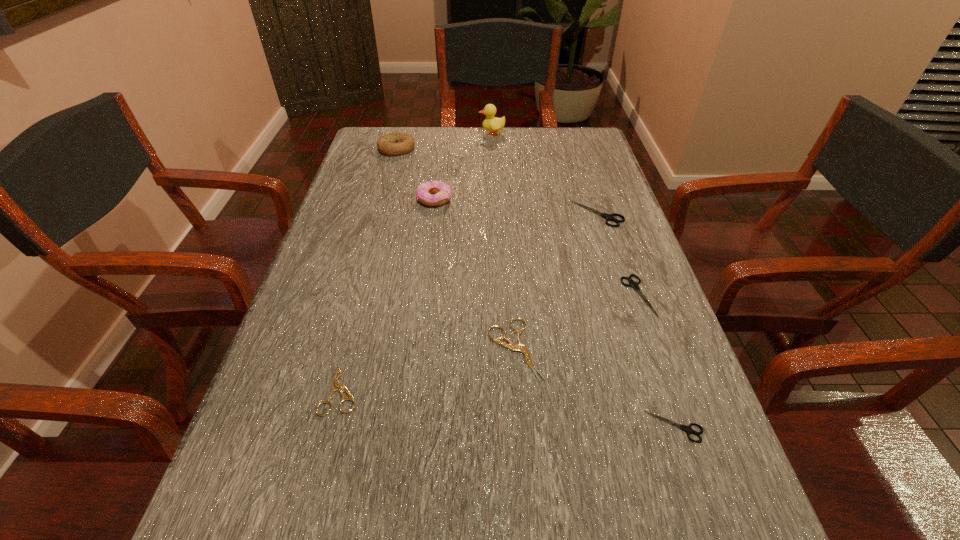
You are a GUI agent. You are given a task and a screenshot of the screen. Output one action in this format:
    pyautogui.click(x=<x>, y=<y>)
    Task: Click on the free area in between the second farthest object and the tallest object
    
    Given the screenshot: What is the action you would take?
    pyautogui.click(x=444, y=141)

Choose which object is the sixth nearest neighbor to the farthest shears. Please provide its 2D coordinates. Your answer should be formatted as a tuple, i.e. [(x, y)], where the tuple contains the x and y coordinates of a point satisfying the conditions above.

[(392, 144)]

Choose which object is the sixth nearest neighbor to the fifth farthest object. Please provide its 2D coordinates. Your answer should be formatted as a tuple, i.e. [(x, y)], where the tuple contains the x and y coordinates of a point satisfying the conditions above.

[(493, 124)]

Identify the location of shears object that ranks as the fourth closest to the fourth shears from right to left. (609, 217).

Point out which shears is positioned as the third nearest to the nearest black shears. Please provide its 2D coordinates. Your answer should be formatted as a tuple, i.e. [(x, y)], where the tuple contains the x and y coordinates of a point satisfying the conditions above.

[(336, 385)]

Find the location of a particular element. This screenshot has width=960, height=540. black shears that is the closest one to the smallest black shears is located at coordinates (633, 284).

Select which black shears appears as the second closest to the brown bagel. Please provide its 2D coordinates. Your answer should be formatted as a tuple, i.e. [(x, y)], where the tuple contains the x and y coordinates of a point satisfying the conditions above.

[(633, 284)]

Locate which beige shears ranks second in proximity to the bagel. Please provide its 2D coordinates. Your answer should be formatted as a tuple, i.e. [(x, y)], where the tuple contains the x and y coordinates of a point satisfying the conditions above.

[(336, 385)]

You are a GUI agent. You are given a task and a screenshot of the screen. Output one action in this format:
    pyautogui.click(x=<x>, y=<y>)
    Task: Click on the beige shears that is the second closest to the nearest black shears
    This screenshot has width=960, height=540.
    Given the screenshot: What is the action you would take?
    pyautogui.click(x=336, y=385)

You are a GUI agent. You are given a task and a screenshot of the screen. Output one action in this format:
    pyautogui.click(x=<x>, y=<y>)
    Task: Click on the free space that satisfies the following two spatial constraints: 1. on the front-facing side of the second nearest black shears; 2. on the left side of the farthest object
    This screenshot has width=960, height=540.
    Given the screenshot: What is the action you would take?
    pyautogui.click(x=498, y=295)